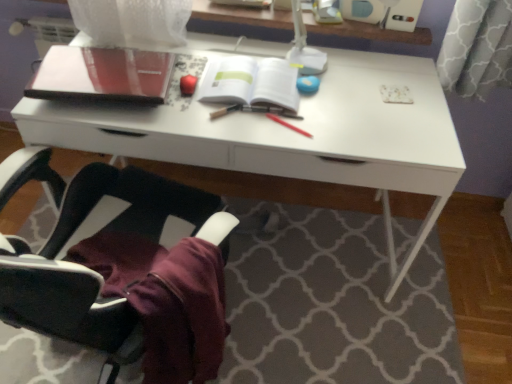
Locate an element on the screen. vacant area that is in front of white paper at center is located at coordinates (251, 129).